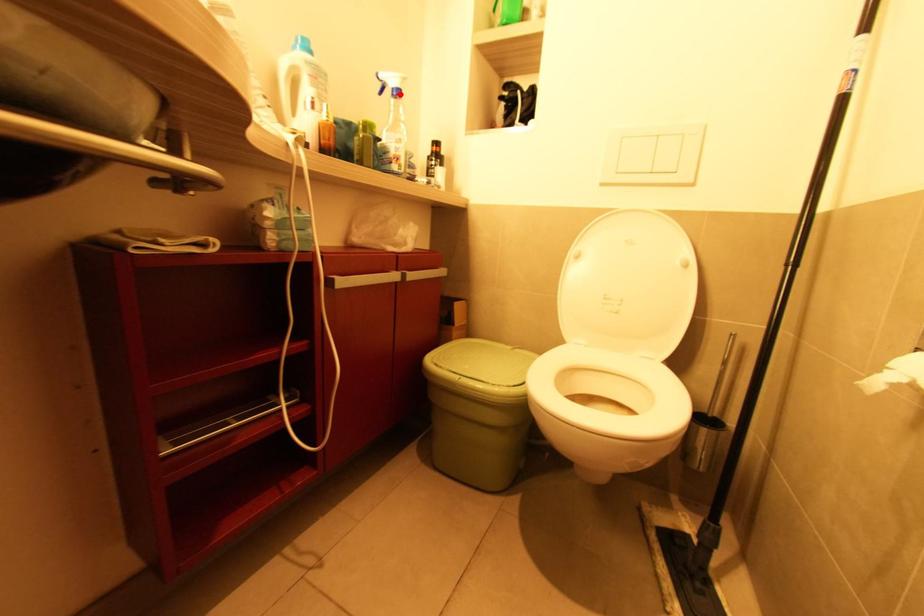
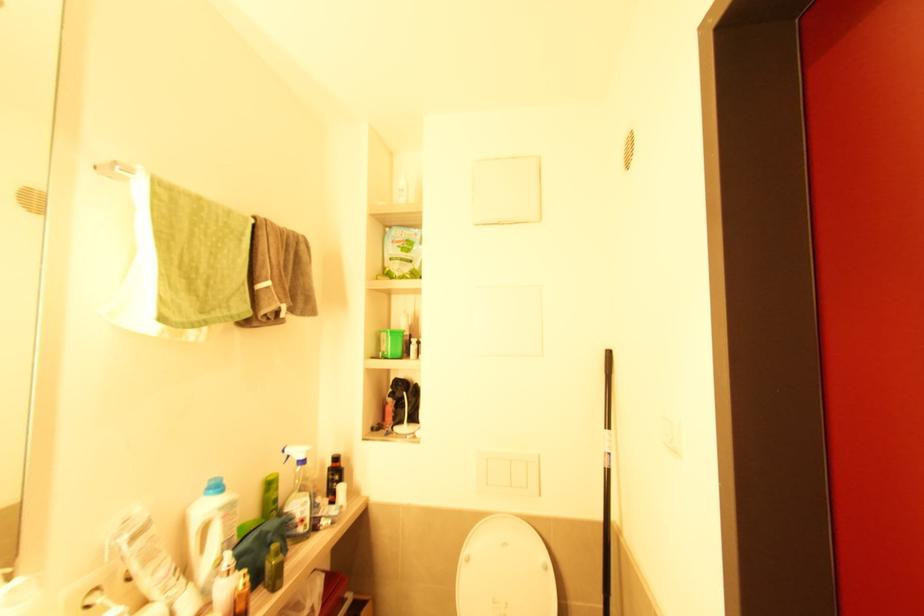
Find the pixel in the second image that matches the highlighted location in the first image.

(305, 462)